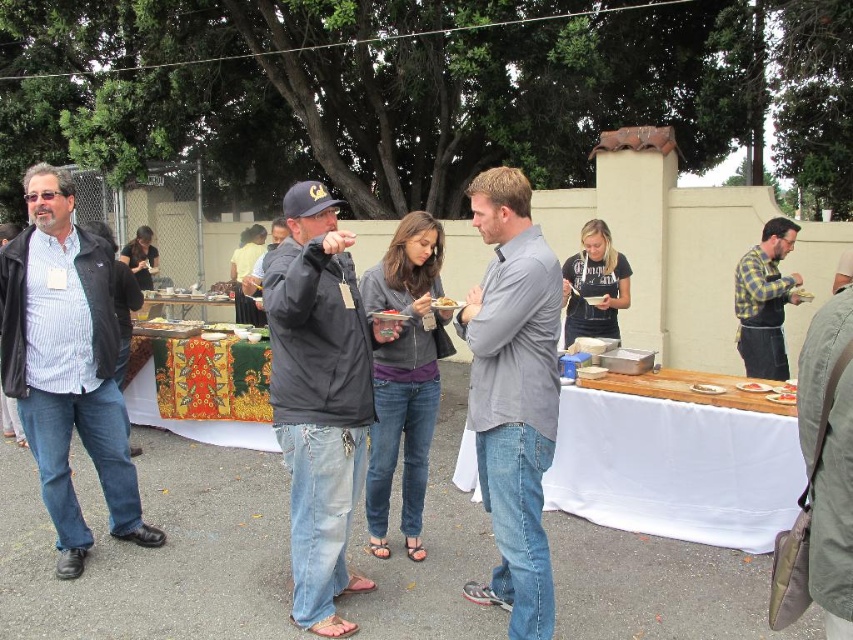
From the picture: Can you confirm if matte black jacket at left is wider than checkered fabric shirt at right?

Yes, matte black jacket at left is wider than checkered fabric shirt at right.

Who is more forward, (109, 513) or (751, 310)?

Point (109, 513)

Is point (4, 308) positioned before point (737, 344)?

Yes.

Find the location of `matte black jacket at left`. matte black jacket at left is located at coordinates (67, 364).

Who is positioned more to the left, checkered fabric shirt at right or golden crispy pastry at center?

Positioned to the left is golden crispy pastry at center.

Is checkered fabric shirt at right above golden crispy pastry at center?

Yes.

Describe the element at coordinates (764, 300) in the screenshot. This screenshot has height=640, width=853. I see `checkered fabric shirt at right` at that location.

You are a GUI agent. You are given a task and a screenshot of the screen. Output one action in this format:
    pyautogui.click(x=<x>, y=<y>)
    Task: Click on the checkered fabric shirt at right
    
    Given the screenshot: What is the action you would take?
    pos(764,300)

Does dark gray jacket at center have a lesser width compared to textured fabric table at center?

Indeed, dark gray jacket at center has a lesser width compared to textured fabric table at center.

Is point (299, 509) farther from camera compared to point (193, 410)?

No, it is not.

Does point (302, 362) come farther from viewer compared to point (244, 435)?

No.

At what (x,y) coordinates should I click in order to perform the action: click on dark gray jacket at center. Please return your answer as a coordinate pair (x, y). The width and height of the screenshot is (853, 640). Looking at the image, I should click on (318, 397).